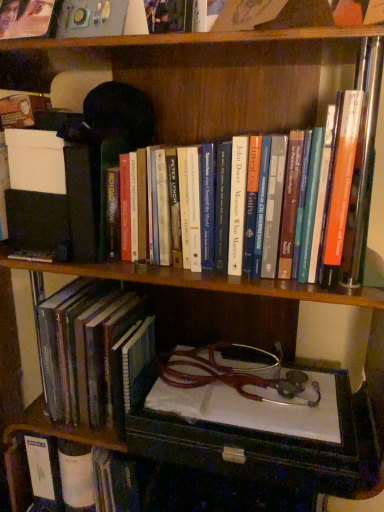
Question: Does hardcover books at center, which is the third book from bottom to top, have a greater width compared to hardcover book at lower left, the 2th book from the bottom?

Choices:
 (A) yes
 (B) no

Answer: (B)

Question: Is hardcover books at center, which is the third book from bottom to top, not within hardcover book at lower left, which is the 2th book from top to bottom?

Choices:
 (A) no
 (B) yes

Answer: (B)

Question: Does hardcover books at center, the first book when ordered from top to bottom, have a smaller size compared to hardcover book at lower left, which is the 2th book from top to bottom?

Choices:
 (A) no
 (B) yes

Answer: (A)

Question: Considering the relative positions of hardcover books at center, which is the third book from bottom to top, and hardcover book at lower left, the 2th book from the bottom, in the image provided, is hardcover books at center, which is the third book from bottom to top, to the right of hardcover book at lower left, the 2th book from the bottom, from the viewer's perspective?

Choices:
 (A) no
 (B) yes

Answer: (B)

Question: Is hardcover book at lower left, the 2th book from the bottom, located within hardcover books at center, the first book when ordered from top to bottom?

Choices:
 (A) yes
 (B) no

Answer: (B)

Question: From a real-world perspective, is hardcover books at center, the first book when ordered from top to bottom, physically above hardcover book at lower left, the 2th book from the bottom?

Choices:
 (A) yes
 (B) no

Answer: (A)

Question: Can you see hardcover book at lower left, acting as the 3th book starting from the top, touching hardcover book at lower left, which is the 2th book from top to bottom?

Choices:
 (A) no
 (B) yes

Answer: (A)

Question: Can you confirm if hardcover book at lower left, acting as the 1th book starting from the bottom, is shorter than hardcover book at lower left, which is the 2th book from top to bottom?

Choices:
 (A) no
 (B) yes

Answer: (B)

Question: From the image's perspective, does hardcover book at lower left, acting as the 1th book starting from the bottom, appear higher than hardcover book at lower left, which is the 2th book from top to bottom?

Choices:
 (A) yes
 (B) no

Answer: (B)

Question: Is the depth of hardcover book at lower left, acting as the 1th book starting from the bottom, greater than that of hardcover book at lower left, which is the 2th book from top to bottom?

Choices:
 (A) yes
 (B) no

Answer: (A)

Question: From a real-world perspective, is hardcover book at lower left, acting as the 1th book starting from the bottom, physically below hardcover book at lower left, the 2th book from the bottom?

Choices:
 (A) yes
 (B) no

Answer: (A)

Question: Is hardcover book at lower left, the 2th book from the bottom, inside hardcover book at lower left, acting as the 1th book starting from the bottom?

Choices:
 (A) yes
 (B) no

Answer: (B)

Question: From the image's perspective, would you say hardcover book at lower left, the 2th book from the bottom, is positioned over hardcover books at center, which is the third book from bottom to top?

Choices:
 (A) no
 (B) yes

Answer: (A)